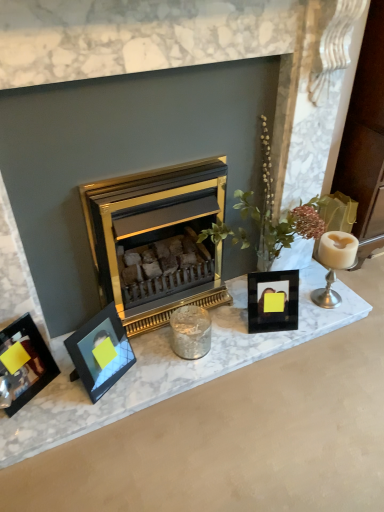
Describe the element at coordinates (100, 352) in the screenshot. I see `matte black picture frame at left, the second picture frame when ordered from right to left` at that location.

Measure the distance between gold metallic fireplace at center and camera.

They are 98.24 centimeters apart.

Where is `gold metallic wood burning stove at center`? This screenshot has width=384, height=512. gold metallic wood burning stove at center is located at coordinates (157, 240).

You are a GUI agent. You are given a task and a screenshot of the screen. Output one action in this format:
    pyautogui.click(x=<x>, y=<y>)
    Task: Click on the black glass photo frame at center, which ranks as the third picture frame in left-to-right order
    
    Given the screenshot: What is the action you would take?
    pyautogui.click(x=273, y=301)

How much space does metallic silver photo frame at left, which is counted as the 3th picture frame, starting from the right, occupy vertically?

It is 10.76 inches.

Locate an element on the screen. matte black picture frame at left, the second picture frame when ordered from right to left is located at coordinates (100, 352).

From their relative heights in the image, would you say silver metallic candle holder at center, marked as the first candle holder in a left-to-right arrangement, is taller or shorter than metallic silver photo frame at left, which is counted as the 3th picture frame, starting from the right?

In the image, silver metallic candle holder at center, marked as the first candle holder in a left-to-right arrangement, appears to be shorter than metallic silver photo frame at left, which is counted as the 3th picture frame, starting from the right.

Considering the sizes of silver metallic candle holder at center, marked as the first candle holder in a left-to-right arrangement, and metallic silver photo frame at left, which is counted as the 3th picture frame, starting from the right, in the image, is silver metallic candle holder at center, marked as the first candle holder in a left-to-right arrangement, wider or thinner than metallic silver photo frame at left, which is counted as the 3th picture frame, starting from the right,?

Clearly, silver metallic candle holder at center, marked as the first candle holder in a left-to-right arrangement, has less width compared to metallic silver photo frame at left, which is counted as the 3th picture frame, starting from the right.

What's the angular difference between silver metallic candle holder at center, marked as the first candle holder in a left-to-right arrangement, and metallic silver photo frame at left, which appears as the 1th picture frame when viewed from the left,'s facing directions?

The angle between the facing direction of silver metallic candle holder at center, marked as the first candle holder in a left-to-right arrangement, and the facing direction of metallic silver photo frame at left, which appears as the 1th picture frame when viewed from the left, is 31.9 degrees.

Is silver metallic candle holder at center, marked as the first candle holder in a left-to-right arrangement, oriented towards metallic silver photo frame at left, which appears as the 1th picture frame when viewed from the left?

No, silver metallic candle holder at center, marked as the first candle holder in a left-to-right arrangement, is not aimed at metallic silver photo frame at left, which appears as the 1th picture frame when viewed from the left.

Could gold metallic wood burning stove at center be considered to be inside white glossy candle holder at right, which appears as the second candle holder when viewed from the left?

No, gold metallic wood burning stove at center is not a part of white glossy candle holder at right, which appears as the second candle holder when viewed from the left.

Is white glossy candle holder at right, which is the first candle holder from right to left, oriented away from gold metallic wood burning stove at center?

No, white glossy candle holder at right, which is the first candle holder from right to left,'s orientation is not away from gold metallic wood burning stove at center.

Considering the points (341, 260) and (227, 298), which point is in front, point (341, 260) or point (227, 298)?

The point (341, 260) is closer.

Is white glossy candle holder at right, which is the first candle holder from right to left, wider than gold metallic wood burning stove at center?

No.

Considering the relative positions of metallic silver photo frame at left, which appears as the 1th picture frame when viewed from the left, and white glossy candle holder at right, which appears as the second candle holder when viewed from the left, in the image provided, is metallic silver photo frame at left, which appears as the 1th picture frame when viewed from the left, to the left or to the right of white glossy candle holder at right, which appears as the second candle holder when viewed from the left,?

metallic silver photo frame at left, which appears as the 1th picture frame when viewed from the left, is to the left of white glossy candle holder at right, which appears as the second candle holder when viewed from the left.

Is metallic silver photo frame at left, which appears as the 1th picture frame when viewed from the left, directly adjacent to white glossy candle holder at right, which is the first candle holder from right to left?

They are not placed beside each other.

Considering the sizes of objects metallic silver photo frame at left, which appears as the 1th picture frame when viewed from the left, and white glossy candle holder at right, which appears as the second candle holder when viewed from the left, in the image provided, who is thinner, metallic silver photo frame at left, which appears as the 1th picture frame when viewed from the left, or white glossy candle holder at right, which appears as the second candle holder when viewed from the left,?

Thinner between the two is metallic silver photo frame at left, which appears as the 1th picture frame when viewed from the left.

Consider the image. From the image's perspective, who appears lower, gold metallic wood burning stove at center or metallic silver photo frame at left, which is counted as the 3th picture frame, starting from the right?

metallic silver photo frame at left, which is counted as the 3th picture frame, starting from the right, appears lower in the image.

From a real-world perspective, which object rests below the other?

In real-world perspective, metallic silver photo frame at left, which is counted as the 3th picture frame, starting from the right, is lower.

Considering the relative sizes of gold metallic wood burning stove at center and metallic silver photo frame at left, which is counted as the 3th picture frame, starting from the right, in the image provided, is gold metallic wood burning stove at center bigger than metallic silver photo frame at left, which is counted as the 3th picture frame, starting from the right,?

Correct, gold metallic wood burning stove at center is larger in size than metallic silver photo frame at left, which is counted as the 3th picture frame, starting from the right.

At what (x,y) coordinates should I click in order to perform the action: click on the 2nd picture frame to the left when counting from the gold metallic wood burning stove at center. Please return your answer as a coordinate pair (x, y). The width and height of the screenshot is (384, 512). Looking at the image, I should click on (23, 364).

Is point (49, 258) more distant than point (191, 313)?

That is False.

Is gold metallic fireplace at center oriented towards silver metallic candle holder at center, the second candle holder positioned from the right?

Yes, gold metallic fireplace at center is oriented towards silver metallic candle holder at center, the second candle holder positioned from the right.

Considering the sizes of objects gold metallic fireplace at center and silver metallic candle holder at center, marked as the first candle holder in a left-to-right arrangement, in the image provided, who is shorter, gold metallic fireplace at center or silver metallic candle holder at center, marked as the first candle holder in a left-to-right arrangement,?

silver metallic candle holder at center, marked as the first candle holder in a left-to-right arrangement.

Does gold metallic fireplace at center have a lesser width compared to silver metallic candle holder at center, the second candle holder positioned from the right?

No, gold metallic fireplace at center is not thinner than silver metallic candle holder at center, the second candle holder positioned from the right.

Considering the sizes of objects white glossy candle holder at right, which is the first candle holder from right to left, and matte black picture frame at left, the second picture frame when ordered from right to left, in the image provided, who is smaller, white glossy candle holder at right, which is the first candle holder from right to left, or matte black picture frame at left, the second picture frame when ordered from right to left,?

white glossy candle holder at right, which is the first candle holder from right to left.

Does white glossy candle holder at right, which is the first candle holder from right to left, touch matte black picture frame at left, which is the second picture frame in left-to-right order?

white glossy candle holder at right, which is the first candle holder from right to left, and matte black picture frame at left, which is the second picture frame in left-to-right order, are clearly separated.

Does point (340, 257) come in front of point (107, 352)?

No, (340, 257) is further to viewer.

Based on the photo, can you tell me how much matte black picture frame at left, which is the second picture frame in left-to-right order, and gold metallic wood burning stove at center differ in facing direction?

They differ by 27.9 degrees in their facing directions.

Would you say matte black picture frame at left, the second picture frame when ordered from right to left, is to the left or to the right of gold metallic wood burning stove at center in the picture?

Clearly, matte black picture frame at left, the second picture frame when ordered from right to left, is on the left of gold metallic wood burning stove at center in the image.

Is matte black picture frame at left, the second picture frame when ordered from right to left, turned away from gold metallic wood burning stove at center?

That's not correct — matte black picture frame at left, the second picture frame when ordered from right to left, is not looking away from gold metallic wood burning stove at center.

From the image's perspective, which picture frame is the 2nd one below the silver metallic candle holder at center, marked as the first candle holder in a left-to-right arrangement? Please provide its 2D coordinates.

[(23, 364)]

Where is `the 2nd candle holder to the right of the gold metallic wood burning stove at center, starting your count from the anchor`? Image resolution: width=384 pixels, height=512 pixels. the 2nd candle holder to the right of the gold metallic wood burning stove at center, starting your count from the anchor is located at coordinates (334, 264).

Looking at the image, which one is located closer to black glass photo frame at center, which ranks as the third picture frame in left-to-right order, gold metallic wood burning stove at center or metallic silver photo frame at left, which is counted as the 3th picture frame, starting from the right?

Based on the image, gold metallic wood burning stove at center appears to be nearer to black glass photo frame at center, which ranks as the third picture frame in left-to-right order.

Estimate the real-world distances between objects in this image. Which object is closer to matte black picture frame at left, which is the second picture frame in left-to-right order, gold metallic wood burning stove at center or silver metallic candle holder at center, marked as the first candle holder in a left-to-right arrangement?

silver metallic candle holder at center, marked as the first candle holder in a left-to-right arrangement, is closer to matte black picture frame at left, which is the second picture frame in left-to-right order.

Looking at the image, which one is located closer to matte black picture frame at left, the second picture frame when ordered from right to left, gold metallic fireplace at center or metallic silver photo frame at left, which is counted as the 3th picture frame, starting from the right?

metallic silver photo frame at left, which is counted as the 3th picture frame, starting from the right, lies closer to matte black picture frame at left, the second picture frame when ordered from right to left, than the other object.

Based on their spatial positions, is white glossy candle holder at right, which appears as the second candle holder when viewed from the left, or silver metallic candle holder at center, marked as the first candle holder in a left-to-right arrangement, further from gold metallic fireplace at center?

silver metallic candle holder at center, marked as the first candle holder in a left-to-right arrangement, is positioned further to the anchor gold metallic fireplace at center.

Which object lies further to the anchor point silver metallic candle holder at center, marked as the first candle holder in a left-to-right arrangement, white glossy candle holder at right, which appears as the second candle holder when viewed from the left, or gold metallic fireplace at center?

gold metallic fireplace at center is further to silver metallic candle holder at center, marked as the first candle holder in a left-to-right arrangement.

When comparing their distances from gold metallic wood burning stove at center, does white glossy candle holder at right, which is the first candle holder from right to left, or silver metallic candle holder at center, the second candle holder positioned from the right, seem closer?

silver metallic candle holder at center, the second candle holder positioned from the right.

Looking at the image, which one is located closer to metallic silver photo frame at left, which is counted as the 3th picture frame, starting from the right, silver metallic candle holder at center, the second candle holder positioned from the right, or black glass photo frame at center, which ranks as the third picture frame in left-to-right order?

silver metallic candle holder at center, the second candle holder positioned from the right, lies closer to metallic silver photo frame at left, which is counted as the 3th picture frame, starting from the right, than the other object.

Estimate the real-world distances between objects in this image. Which object is closer to matte black picture frame at left, the second picture frame when ordered from right to left, black glass photo frame at center, which is the first picture frame from right to left, or gold metallic wood burning stove at center?

gold metallic wood burning stove at center lies closer to matte black picture frame at left, the second picture frame when ordered from right to left, than the other object.

Locate an element on the screen. The height and width of the screenshot is (512, 384). picture frame between metallic silver photo frame at left, which appears as the 1th picture frame when viewed from the left, and gold metallic wood burning stove at center is located at coordinates (100, 352).

Image resolution: width=384 pixels, height=512 pixels. I want to click on candle holder between gold metallic fireplace at center and white glossy candle holder at right, which is the first candle holder from right to left, along the z-axis, so click(190, 332).

Find the location of a particular element. This screenshot has width=384, height=512. wood burning stove between metallic silver photo frame at left, which appears as the 1th picture frame when viewed from the left, and white glossy candle holder at right, which appears as the second candle holder when viewed from the left is located at coordinates (157, 240).

Identify the location of fireplace situated between matte black picture frame at left, which is the second picture frame in left-to-right order, and white glossy candle holder at right, which is the first candle holder from right to left, from left to right. The height and width of the screenshot is (512, 384). (174, 130).